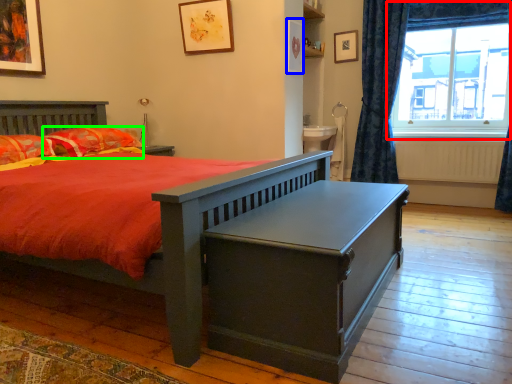
Question: Which is farther away from window (highlighted by a red box)? picture frame (highlighted by a blue box) or pillow (highlighted by a green box)?

Choices:
 (A) picture frame
 (B) pillow

Answer: (B)